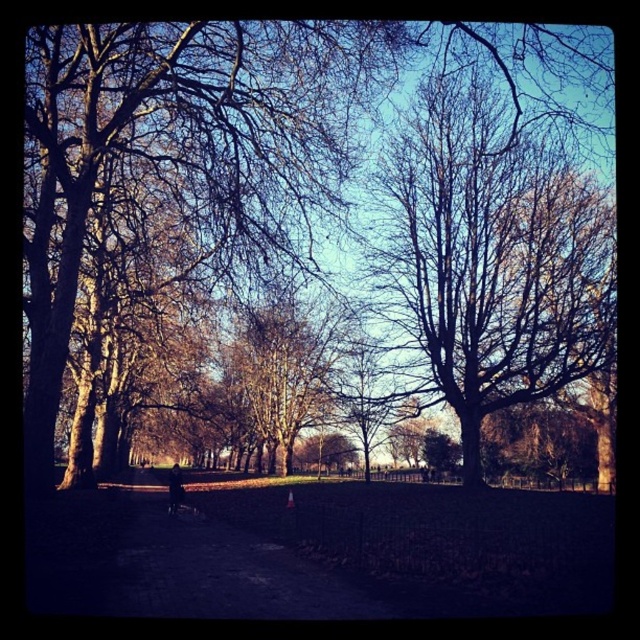
Question: Can you confirm if bare wood tree at center is wider than smooth bark tree at center?

Choices:
 (A) no
 (B) yes

Answer: (B)

Question: Which object is the closest to the brown leafless tree at center?

Choices:
 (A) smooth bark tree at center
 (B) dark asphalt path at center
 (C) bare wood tree at center

Answer: (C)

Question: Which point is farther from the camera taking this photo?

Choices:
 (A) (252, 352)
 (B) (358, 616)
 (C) (516, 180)

Answer: (A)

Question: Does bare wood tree at center have a larger size compared to smooth bark tree at center?

Choices:
 (A) yes
 (B) no

Answer: (B)

Question: Can you confirm if bare wood tree at center is positioned below smooth bark tree at center?

Choices:
 (A) yes
 (B) no

Answer: (B)

Question: Which object is closer to the camera taking this photo?

Choices:
 (A) bare wood tree at center
 (B) brown leafless tree at center

Answer: (B)